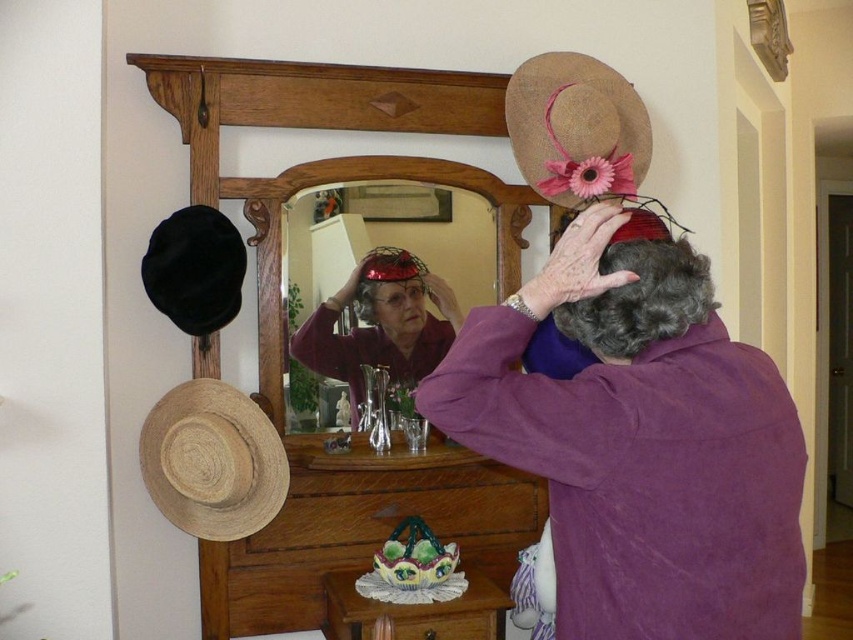
You are a delivery person who needs to place a package on a surface that can hold at least 10 pounds. The wooden dresser at center can hold up to 20 pounds, and the brown straw cowboy hat at upper center can hold nothing. Which object should you choose?

The wooden dresser at center can hold up to 20 pounds, so you should choose the wooden dresser at center to place the package.

You are trying to choose between the natural straw hat at left and the matte red helmet at center to wear for a casual day out. Which one has a wider brim or broader design that might offer better sun protection?

The natural straw hat at left has a larger width than the matte red helmet at center, making it a better choice for sun protection due to its broader design.